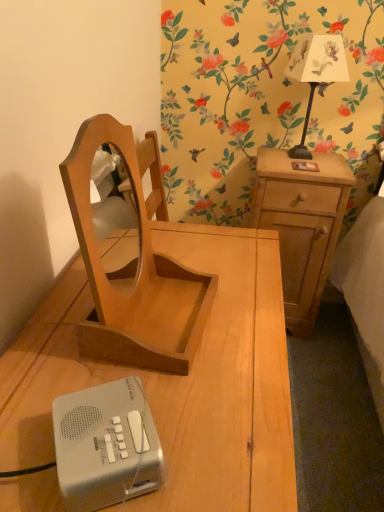
Locate an element on the screen. The width and height of the screenshot is (384, 512). white paper lampshade at upper right is located at coordinates (316, 73).

What is the approximate width of silver plastic radio at lower left?

The width of silver plastic radio at lower left is 12.18 centimeters.

This screenshot has height=512, width=384. I want to click on light brown wood mirror at center, so click(133, 274).

What is the approximate width of light brown wood mirror at center?

The width of light brown wood mirror at center is 7.52 inches.

I want to click on white paper lampshade at upper right, so click(x=316, y=73).

Is wooden nightstand at center, the first nightstand viewed from the left, next to white paper lampshade at upper right?

wooden nightstand at center, the first nightstand viewed from the left, and white paper lampshade at upper right are clearly separated.

Can you confirm if wooden nightstand at center, the second nightstand when ordered from back to front, is positioned to the right of white paper lampshade at upper right?

No.

Is wooden nightstand at center, placed as the second nightstand when sorted from right to left, looking in the opposite direction of white paper lampshade at upper right?

wooden nightstand at center, placed as the second nightstand when sorted from right to left, does not have its back to white paper lampshade at upper right.

You are a GUI agent. You are given a task and a screenshot of the screen. Output one action in this format:
    pyautogui.click(x=<x>, y=<y>)
    Task: Click on the bedside lamp that is above the wooden nightstand at center, which is the first nightstand from front to back (from the image's perspective)
    The height and width of the screenshot is (512, 384).
    Given the screenshot: What is the action you would take?
    pyautogui.click(x=316, y=73)

From a real-world perspective, which object rests below the other?

In real-world perspective, silver plastic radio at lower left is lower.

In the image, is white paper lampshade at upper right positioned in front of or behind silver plastic radio at lower left?

Visually, white paper lampshade at upper right is located behind silver plastic radio at lower left.

From the image's perspective, is white paper lampshade at upper right under silver plastic radio at lower left?

Incorrect, from the image's perspective, white paper lampshade at upper right is higher than silver plastic radio at lower left.

Based on their sizes in the image, would you say white paper lampshade at upper right is bigger or smaller than silver plastic radio at lower left?

In the image, white paper lampshade at upper right appears to be larger than silver plastic radio at lower left.

Is wooden nightstand at center, which is the first nightstand from front to back, facing towards light brown wood at right, the first nightstand viewed from the back?

No, wooden nightstand at center, which is the first nightstand from front to back, does not turn towards light brown wood at right, the first nightstand viewed from the back.

Which of these two, wooden nightstand at center, the first nightstand viewed from the left, or light brown wood at right, the first nightstand viewed from the back, stands shorter?

Standing shorter between the two is light brown wood at right, the first nightstand viewed from the back.

Which is behind, wooden nightstand at center, placed as the second nightstand when sorted from right to left, or light brown wood at right, the 1th nightstand in the right-to-left sequence?

Positioned behind is light brown wood at right, the 1th nightstand in the right-to-left sequence.

Can you confirm if wooden nightstand at center, the second nightstand when ordered from back to front, is positioned to the right of light brown wood at right, the second nightstand positioned from the front?

No, wooden nightstand at center, the second nightstand when ordered from back to front, is not to the right of light brown wood at right, the second nightstand positioned from the front.

Is silver plastic radio at lower left far away from wooden nightstand at center, the second nightstand when ordered from back to front?

silver plastic radio at lower left is near wooden nightstand at center, the second nightstand when ordered from back to front, not far away.

Which of these two, silver plastic radio at lower left or wooden nightstand at center, placed as the second nightstand when sorted from right to left, is wider?

wooden nightstand at center, placed as the second nightstand when sorted from right to left, is wider.

Which point is more distant from viewer, (78, 408) or (38, 454)?

Point (78, 408)

From the picture: Can wooden nightstand at center, which is the first nightstand from front to back, be found inside silver plastic radio at lower left?

Definitely not — wooden nightstand at center, which is the first nightstand from front to back, is not inside silver plastic radio at lower left.

Based on the photo, is the surface of light brown wood at right, the second nightstand positioned from the front, in direct contact with silver plastic radio at lower left?

No, light brown wood at right, the second nightstand positioned from the front, is not with silver plastic radio at lower left.

From the image's perspective, does light brown wood at right, which is the 2th nightstand from left to right, appear higher than silver plastic radio at lower left?

Yes.

Where is `the 2nd nightstand to the right of the silver plastic radio at lower left, starting your count from the anchor`? the 2nd nightstand to the right of the silver plastic radio at lower left, starting your count from the anchor is located at coordinates (302, 225).

Does light brown wood mirror at center lie in front of light brown wood at right, which is the 2th nightstand from left to right?

Yes, it is in front of light brown wood at right, which is the 2th nightstand from left to right.

Is light brown wood mirror at center situated inside light brown wood at right, the 1th nightstand in the right-to-left sequence, or outside?

light brown wood mirror at center is not enclosed by light brown wood at right, the 1th nightstand in the right-to-left sequence.

Is light brown wood mirror at center oriented away from light brown wood at right, the first nightstand viewed from the back?

light brown wood mirror at center does not have its back to light brown wood at right, the first nightstand viewed from the back.

In terms of width, does light brown wood mirror at center look wider or thinner when compared to light brown wood at right, the 1th nightstand in the right-to-left sequence?

Clearly, light brown wood mirror at center has less width compared to light brown wood at right, the 1th nightstand in the right-to-left sequence.

From the picture: Considering the positions of objects white paper lampshade at upper right and light brown wood at right, the 1th nightstand in the right-to-left sequence, in the image provided, who is more to the right, white paper lampshade at upper right or light brown wood at right, the 1th nightstand in the right-to-left sequence,?

From the viewer's perspective, white paper lampshade at upper right appears more on the right side.

Is light brown wood at right, the 1th nightstand in the right-to-left sequence, at the back of white paper lampshade at upper right?

No, white paper lampshade at upper right is not facing away from light brown wood at right, the 1th nightstand in the right-to-left sequence.

Between white paper lampshade at upper right and light brown wood at right, the first nightstand viewed from the back, which one has larger size?

Bigger between the two is light brown wood at right, the first nightstand viewed from the back.

Is point (311, 80) behind point (297, 211)?

No, (311, 80) is closer to viewer.

Where is `bedside lamp above the wooden nightstand at center, which is the first nightstand from front to back (from a real-world perspective)`? The image size is (384, 512). bedside lamp above the wooden nightstand at center, which is the first nightstand from front to back (from a real-world perspective) is located at coordinates tap(316, 73).

Where is `bedside lamp located on the right of silver plastic radio at lower left`? bedside lamp located on the right of silver plastic radio at lower left is located at coordinates (316, 73).

From the picture: Looking at the image, which one is located closer to light brown wood at right, the second nightstand positioned from the front, wooden nightstand at center, which is the first nightstand from front to back, or light brown wood mirror at center?

The object closer to light brown wood at right, the second nightstand positioned from the front, is wooden nightstand at center, which is the first nightstand from front to back.

From the image, which object appears to be farther from light brown wood at right, the first nightstand viewed from the back, white paper lampshade at upper right or silver plastic radio at lower left?

The object further to light brown wood at right, the first nightstand viewed from the back, is silver plastic radio at lower left.

Considering their positions, is white paper lampshade at upper right positioned further to light brown wood at right, the first nightstand viewed from the back, than light brown wood mirror at center?

light brown wood mirror at center.

From the image, which object appears to be nearer to light brown wood at right, which is the 2th nightstand from left to right, light brown wood mirror at center or wooden nightstand at center, which is the first nightstand from front to back?

wooden nightstand at center, which is the first nightstand from front to back, lies closer to light brown wood at right, which is the 2th nightstand from left to right, than the other object.

From the image, which object appears to be nearer to white paper lampshade at upper right, light brown wood at right, which is the 2th nightstand from left to right, or wooden nightstand at center, which is the first nightstand from front to back?

light brown wood at right, which is the 2th nightstand from left to right, lies closer to white paper lampshade at upper right than the other object.

Estimate the real-world distances between objects in this image. Which object is closer to light brown wood mirror at center, silver plastic radio at lower left or light brown wood at right, the 1th nightstand in the right-to-left sequence?

silver plastic radio at lower left is positioned closer to the anchor light brown wood mirror at center.

From the image, which object appears to be nearer to wooden nightstand at center, which is the first nightstand from front to back, light brown wood mirror at center or silver plastic radio at lower left?

Among the two, light brown wood mirror at center is located nearer to wooden nightstand at center, which is the first nightstand from front to back.

When comparing their distances from silver plastic radio at lower left, does wooden nightstand at center, placed as the second nightstand when sorted from right to left, or light brown wood at right, the second nightstand positioned from the front, seem further?

light brown wood at right, the second nightstand positioned from the front, lies further to silver plastic radio at lower left than the other object.

Locate an element on the screen. gadget positioned between wooden nightstand at center, which is the first nightstand from front to back, and light brown wood at right, which is the 2th nightstand from left to right, from near to far is located at coordinates (106, 445).

This screenshot has width=384, height=512. Find the location of `furniture located between wooden nightstand at center, placed as the second nightstand when sorted from right to left, and light brown wood at right, the second nightstand positioned from the front, in the depth direction`. furniture located between wooden nightstand at center, placed as the second nightstand when sorted from right to left, and light brown wood at right, the second nightstand positioned from the front, in the depth direction is located at coordinates (133, 274).

Where is `furniture located between wooden nightstand at center, the second nightstand when ordered from back to front, and white paper lampshade at upper right in the depth direction`? furniture located between wooden nightstand at center, the second nightstand when ordered from back to front, and white paper lampshade at upper right in the depth direction is located at coordinates (133, 274).

You are a GUI agent. You are given a task and a screenshot of the screen. Output one action in this format:
    pyautogui.click(x=<x>, y=<y>)
    Task: Click on the furniture located between silver plastic radio at lower left and white paper lampshade at upper right in the depth direction
    
    Given the screenshot: What is the action you would take?
    pyautogui.click(x=133, y=274)